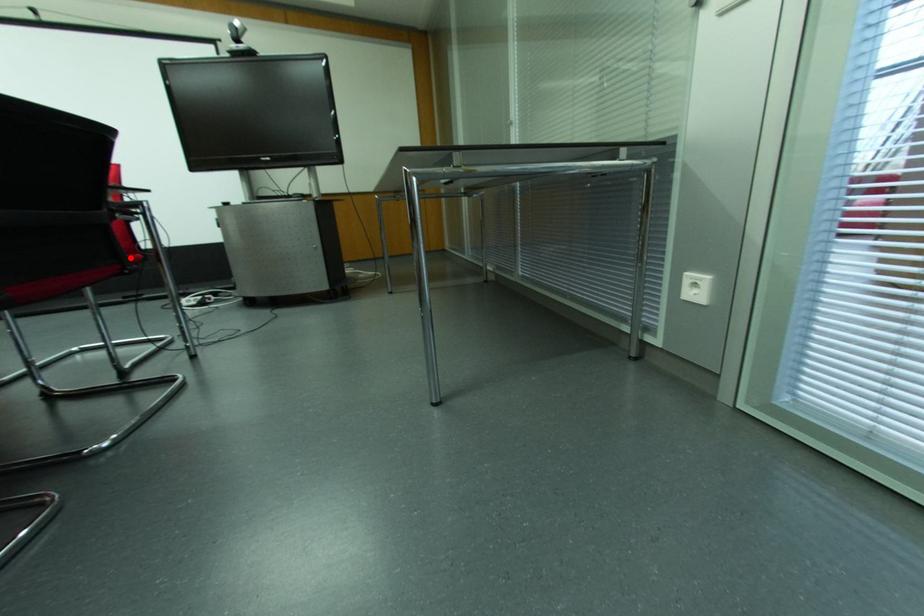
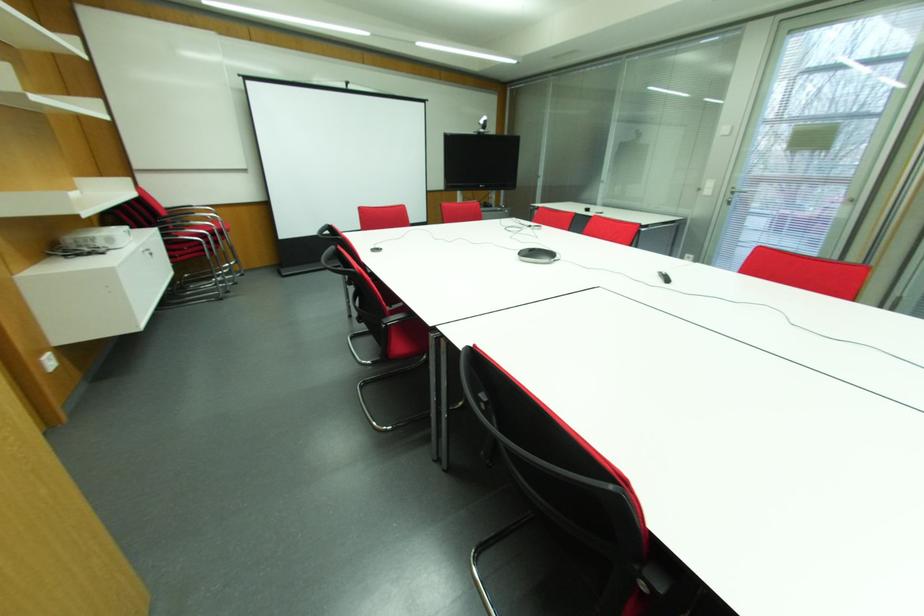
Question: I am providing you with two images of the same scene from different viewpoints. A red point is marked on the first image. At the location where the point appears in image 1, is it still visible in image 2?

Choices:
 (A) Yes
 (B) No

Answer: (B)